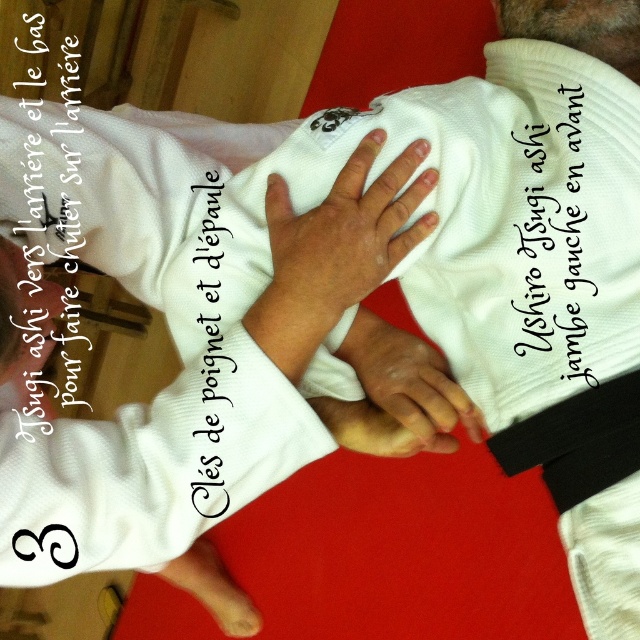
Who is more distant from viewer, [204,458] or [198,321]?

The point [198,321] is more distant.

Is point (108, 483) positioned in front of point (218, 484)?

Yes, point (108, 483) is closer to viewer.

Where is `white ribbed robe at center`? The image size is (640, 640). white ribbed robe at center is located at coordinates (173, 337).

From the picture: Is the position of black fabric text at upper center more distant than that of black fabric belt at lower right?

That is True.

Can you confirm if black fabric text at upper center is thinner than black fabric belt at lower right?

Correct, black fabric text at upper center's width is less than black fabric belt at lower right's.

The image size is (640, 640). What do you see at coordinates (556, 237) in the screenshot?
I see `black fabric text at upper center` at bounding box center [556, 237].

Locate an element on the screen. The image size is (640, 640). black fabric text at upper center is located at coordinates (556, 237).

Looking at this image, how distant is black fabric belt at lower right from white paper text at upper left?

black fabric belt at lower right is 65.07 centimeters from white paper text at upper left.

Consider the image. Who is positioned more to the left, black fabric belt at lower right or white paper text at upper left?

white paper text at upper left is more to the left.

Between point (632, 404) and point (65, 76), which one is positioned in front?

Point (632, 404)

This screenshot has width=640, height=640. Find the location of `black fabric belt at lower right`. black fabric belt at lower right is located at coordinates (577, 442).